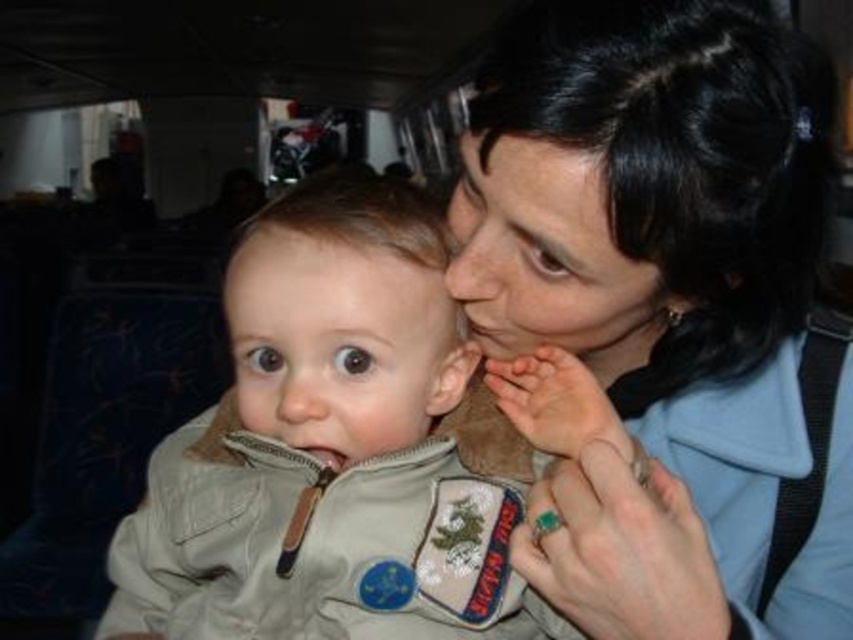
Based on the photo, you are a tailor trying to determine which item requires more fabric for a new order. Based on the image, which object is wider between the matte khaki jacket at center and the light brown matte forehead at center?

The matte khaki jacket at center is wider than the light brown matte forehead at center according to the description.

Based on the scene description, where is the smooth beige baby at center located in terms of coordinates?

The smooth beige baby at center is located at coordinates point (338,344).

You are sitting on a train and want to place your bag between the two points, point [590,296] and point [433,317]. Which point should you place the bag closer to so that it is in front of the other point?

You should place the bag closer to point [590,296] because it is in front of point [433,317].